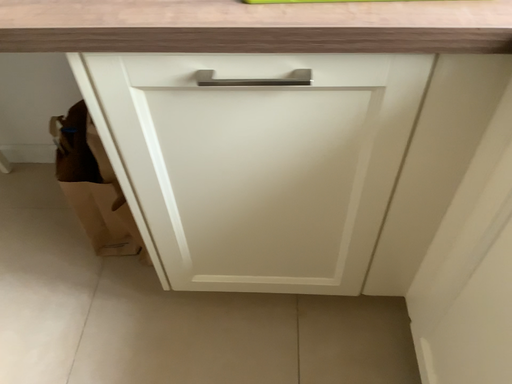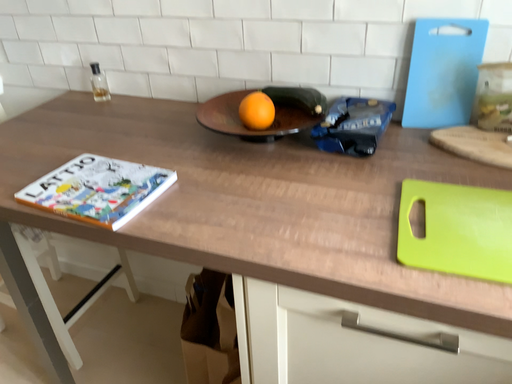
Question: Which way did the camera rotate in the video?

Choices:
 (A) rotated upward
 (B) rotated downward

Answer: (A)